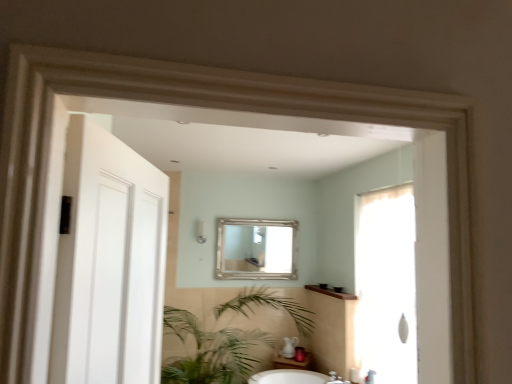
Question: Considering the relative sizes of silver metallic mirror at center and white matte door at left in the image provided, is silver metallic mirror at center smaller than white matte door at left?

Choices:
 (A) no
 (B) yes

Answer: (B)

Question: Is silver metallic mirror at center turned away from white matte door at left?

Choices:
 (A) yes
 (B) no

Answer: (B)

Question: Is silver metallic mirror at center positioned beyond the bounds of white matte door at left?

Choices:
 (A) yes
 (B) no

Answer: (A)

Question: From a real-world perspective, is silver metallic mirror at center under white matte door at left?

Choices:
 (A) no
 (B) yes

Answer: (A)

Question: Is silver metallic mirror at center in front of white matte door at left?

Choices:
 (A) no
 (B) yes

Answer: (A)

Question: Based on their sizes in the image, would you say white matte door at left is bigger or smaller than silver metallic mirror at center?

Choices:
 (A) big
 (B) small

Answer: (A)

Question: Is white matte door at left in front of or behind silver metallic mirror at center in the image?

Choices:
 (A) behind
 (B) front

Answer: (B)

Question: Looking at their shapes, would you say white matte door at left is wider or thinner than silver metallic mirror at center?

Choices:
 (A) wide
 (B) thin

Answer: (A)

Question: Would you say white matte door at left is to the left or to the right of silver metallic mirror at center in the picture?

Choices:
 (A) left
 (B) right

Answer: (A)

Question: From the image's perspective, relative to white matte door at left, is translucent fabric screen door at right above or below?

Choices:
 (A) below
 (B) above

Answer: (A)

Question: Would you say translucent fabric screen door at right is to the left or to the right of white matte door at left in the picture?

Choices:
 (A) left
 (B) right

Answer: (B)

Question: In terms of size, does translucent fabric screen door at right appear bigger or smaller than white matte door at left?

Choices:
 (A) big
 (B) small

Answer: (A)

Question: Is translucent fabric screen door at right wider or thinner than white matte door at left?

Choices:
 (A) thin
 (B) wide

Answer: (B)

Question: Is point (395, 360) positioned closer to the camera than point (230, 266)?

Choices:
 (A) farther
 (B) closer

Answer: (B)

Question: Is translucent fabric screen door at right in front of or behind silver metallic mirror at center in the image?

Choices:
 (A) behind
 (B) front

Answer: (B)